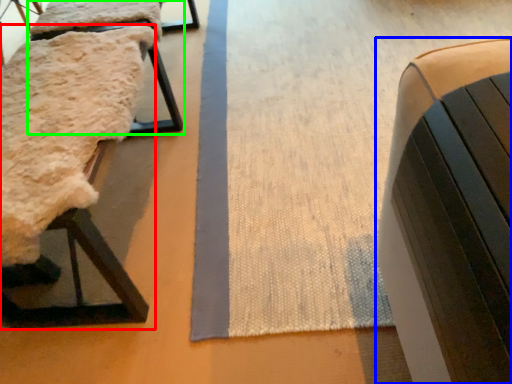
Question: Estimate the real-world distances between objects in this image. Which object is farther from furniture (highlighted by a red box), furniture (highlighted by a blue box) or furniture (highlighted by a green box)?

Choices:
 (A) furniture
 (B) furniture

Answer: (A)